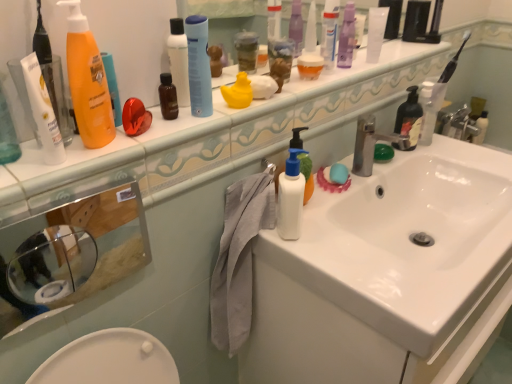
Locate an element on the screen. The image size is (512, 384). vacant area that lies between white glossy tube at upper center, the 3th toiletry viewed from the right, and translucent plastic container at upper center, which is counted as the 5th toiletry, starting from the back is located at coordinates (349, 71).